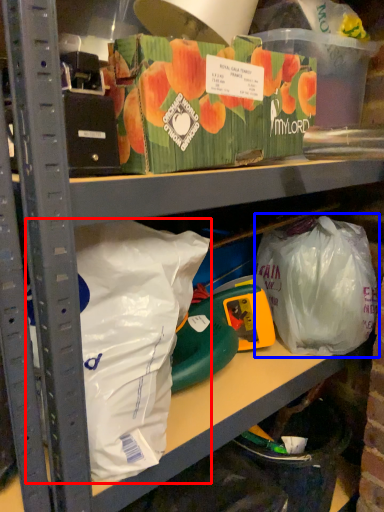
Question: Which point is closer to the camera, plastic bag (highlighted by a red box) or plastic bag (highlighted by a blue box)?

Choices:
 (A) plastic bag
 (B) plastic bag

Answer: (A)